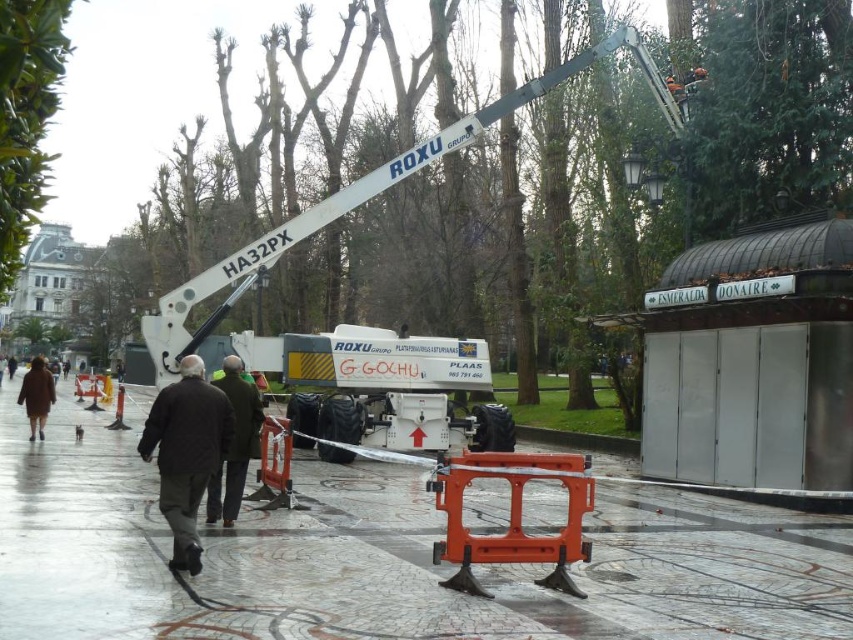
You are a delivery person trying to place a large package on the polished stone pavement at center. The package is as wide as the dark brown leather jacket at center. Will the package fit on the pavement?

The polished stone pavement at center might be wider than the dark brown leather jacket at center, so the package should fit if the pavement is indeed wider. However, since the exact width difference isn not specified, there is some uncertainty.

You are a delivery person trying to navigate through the park to reach the kiosk labeled ESMERALDA DONAIRE. There is a polished stone pavement at center and a green leafy tree at upper left. Which object should you avoid to stay on the correct path towards the kiosk?

The green leafy tree at upper left is located to the left of the polished stone pavement at center, so you should avoid the green leafy tree at upper left to stay on the correct path towards the kiosk.